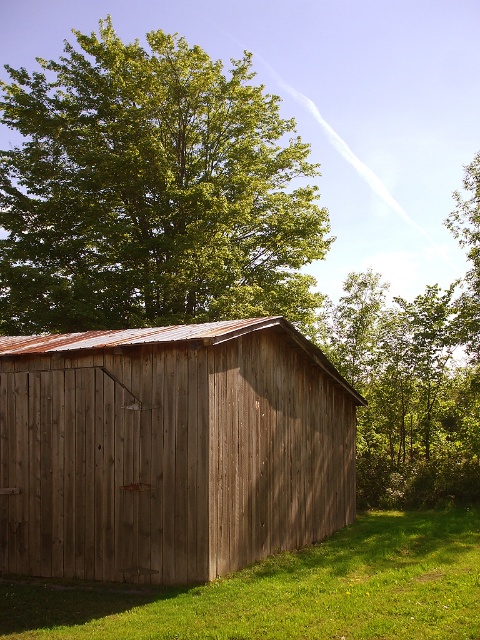
This screenshot has height=640, width=480. What are the coordinates of `green grass at lower right` in the screenshot? It's located at (285, 592).

Is green leafy tree at upper left above green grass at lower right?

Yes.

Does point (197, 280) come behind point (146, 608)?

Yes, it is behind point (146, 608).

This screenshot has height=640, width=480. Find the location of `green leafy tree at upper left`. green leafy tree at upper left is located at coordinates (151, 192).

This screenshot has width=480, height=640. I want to click on green leafy tree at upper left, so coord(151,192).

Is wooden barn at center wider than green leafy tree at upper left?

In fact, wooden barn at center might be narrower than green leafy tree at upper left.

Can you confirm if wooden barn at center is positioned to the left of green leafy tree at upper left?

Incorrect, wooden barn at center is not on the left side of green leafy tree at upper left.

Who is more distant from viewer, [268,410] or [145,204]?

Point [145,204]

Locate an element on the screen. Image resolution: width=480 pixels, height=640 pixels. wooden barn at center is located at coordinates (170, 449).